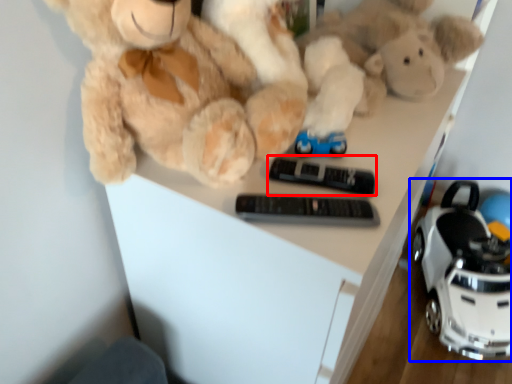
Question: Which of the following is the closest to the observer, control (highlighted by a red box) or land vehicle (highlighted by a blue box)?

Choices:
 (A) control
 (B) land vehicle

Answer: (A)